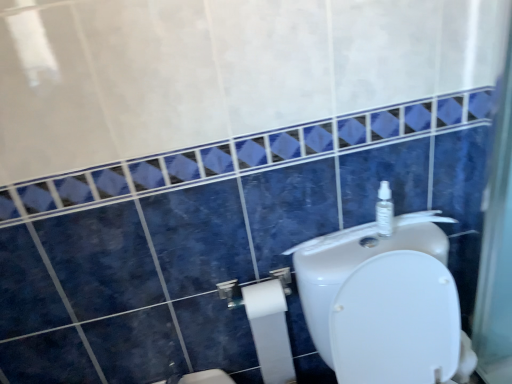
Question: Is white glossy toilet at upper right inside or outside of white matte toilet paper at lower center?

Choices:
 (A) inside
 (B) outside

Answer: (B)

Question: Considering their positions, is white glossy toilet at upper right located in front of or behind white matte toilet paper at lower center?

Choices:
 (A) front
 (B) behind

Answer: (A)

Question: Which object is positioned closest to the clear plastic spray bottle at upper right?

Choices:
 (A) white matte toilet paper at lower center
 (B) white matte toilet paper at lower center
 (C) white glossy toilet at upper right

Answer: (C)

Question: Which of these objects is positioned farthest from the white glossy toilet at upper right?

Choices:
 (A) white matte toilet paper at lower center
 (B) clear plastic spray bottle at upper right
 (C) white matte toilet paper at lower center

Answer: (C)